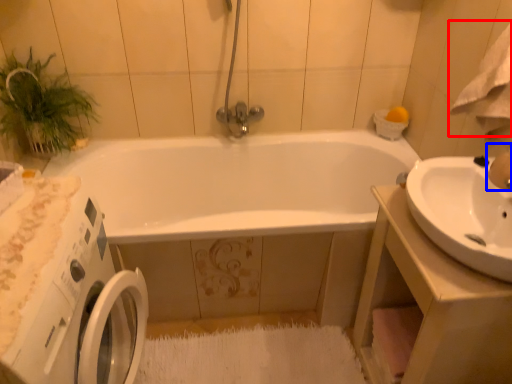
Question: Which object appears closest to the camera in this image, bath towel (highlighted by a red box) or faucet (highlighted by a blue box)?

Choices:
 (A) bath towel
 (B) faucet

Answer: (A)